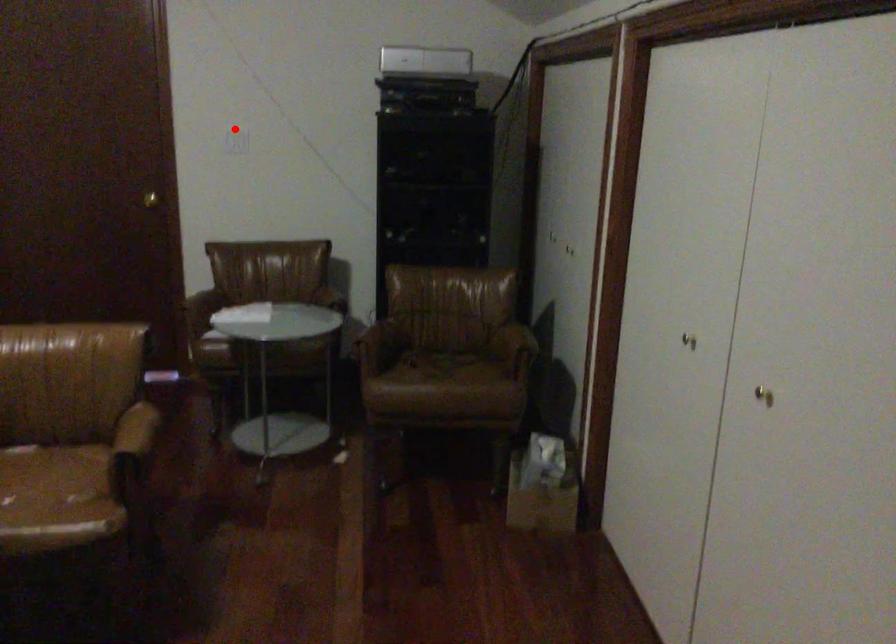
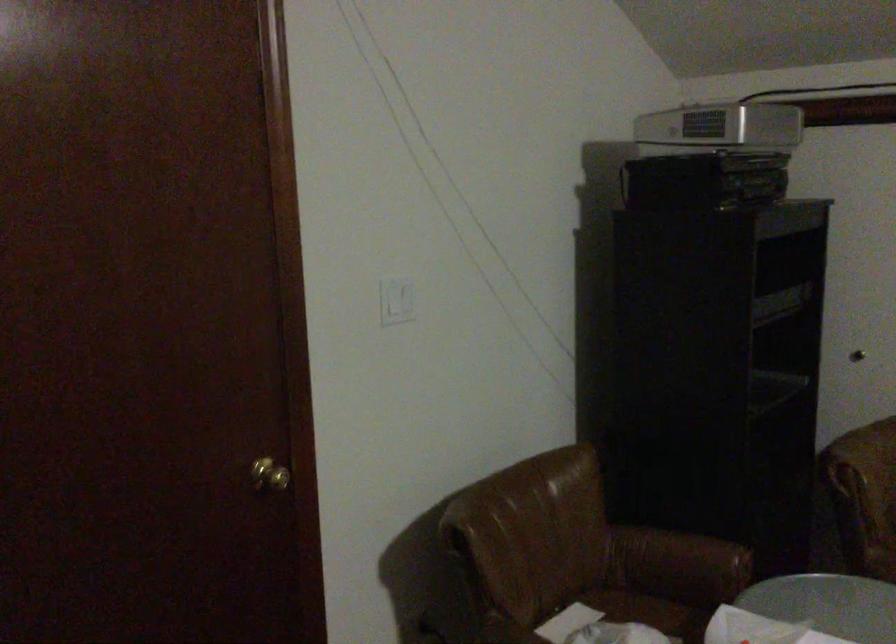
Question: A red point is marked in image1. In image2, is the corresponding 3D point closer to the camera or farther? Reply with the corresponding letter.

Choices:
 (A) The corresponding 3D point is closer.
 (B) The corresponding 3D point is farther.

Answer: (A)